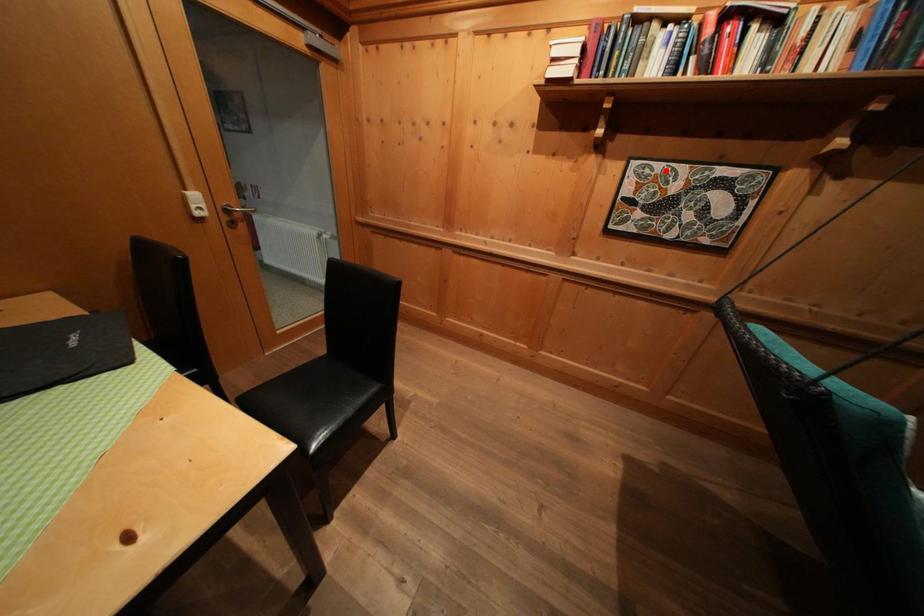
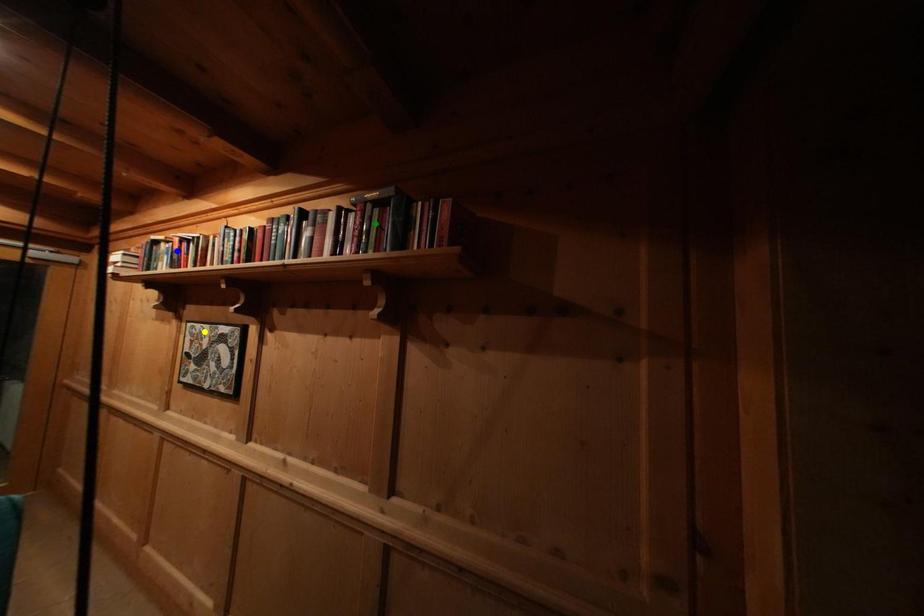
Question: I am providing you with two images of the same scene from different viewpoints. A red point is marked on the first image. You are given multiple points on the second image. Which point in image 2 represents the same 3d spot as the red point in image 1?

Choices:
 (A) green point
 (B) blue point
 (C) yellow point

Answer: (C)